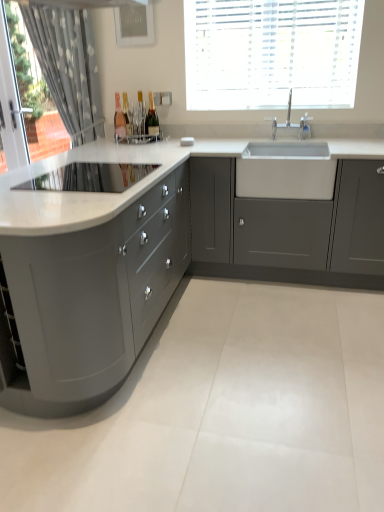
Question: From a real-world perspective, is matte gray cabinet at center, which appears as the 2th cabinetry when viewed from the left, on top of matte gray cabinets at left, which is the 1th cabinetry in left-to-right order?

Choices:
 (A) no
 (B) yes

Answer: (B)

Question: Can you confirm if matte gray cabinet at center, marked as the first cabinetry in a right-to-left arrangement, is positioned to the left of matte gray cabinets at left, which is the 1th cabinetry in left-to-right order?

Choices:
 (A) yes
 (B) no

Answer: (B)

Question: Is matte gray cabinet at center, which appears as the 2th cabinetry when viewed from the left, wider than matte gray cabinets at left, the 2th cabinetry viewed from the right?

Choices:
 (A) yes
 (B) no

Answer: (B)

Question: Is matte gray cabinet at center, marked as the first cabinetry in a right-to-left arrangement, not within matte gray cabinets at left, which is the 1th cabinetry in left-to-right order?

Choices:
 (A) no
 (B) yes

Answer: (B)

Question: Does matte gray cabinet at center, marked as the first cabinetry in a right-to-left arrangement, have a smaller size compared to matte gray cabinets at left, which is the 1th cabinetry in left-to-right order?

Choices:
 (A) yes
 (B) no

Answer: (A)

Question: From a real-world perspective, is white textured blinds at upper center physically located above or below gray fabric curtain at left?

Choices:
 (A) above
 (B) below

Answer: (A)

Question: Considering the positions of point (302, 90) and point (62, 96), is point (302, 90) closer or farther from the camera than point (62, 96)?

Choices:
 (A) farther
 (B) closer

Answer: (B)

Question: Is white textured blinds at upper center in front of or behind gray fabric curtain at left in the image?

Choices:
 (A) behind
 (B) front

Answer: (B)

Question: Looking at the image, does white textured blinds at upper center seem bigger or smaller compared to gray fabric curtain at left?

Choices:
 (A) big
 (B) small

Answer: (B)

Question: Is point (365, 280) positioned closer to the camera than point (152, 125)?

Choices:
 (A) farther
 (B) closer

Answer: (B)

Question: From a real-world perspective, is matte gray cabinet at center, which appears as the 2th cabinetry when viewed from the left, positioned above or below matte glass bottle at upper center, positioned as the first bottle in right-to-left order?

Choices:
 (A) below
 (B) above

Answer: (A)

Question: Is matte gray cabinet at center, marked as the first cabinetry in a right-to-left arrangement, to the left or to the right of matte glass bottle at upper center, which is the second bottle in left-to-right order, in the image?

Choices:
 (A) right
 (B) left

Answer: (A)

Question: Is matte gray cabinet at center, marked as the first cabinetry in a right-to-left arrangement, bigger or smaller than matte glass bottle at upper center, positioned as the first bottle in right-to-left order?

Choices:
 (A) small
 (B) big

Answer: (B)

Question: From the image's perspective, relative to white ceramic tap at upper center, is white textured blinds at upper center above or below?

Choices:
 (A) below
 (B) above

Answer: (B)

Question: Looking at their shapes, would you say white textured blinds at upper center is wider or thinner than white ceramic tap at upper center?

Choices:
 (A) thin
 (B) wide

Answer: (A)